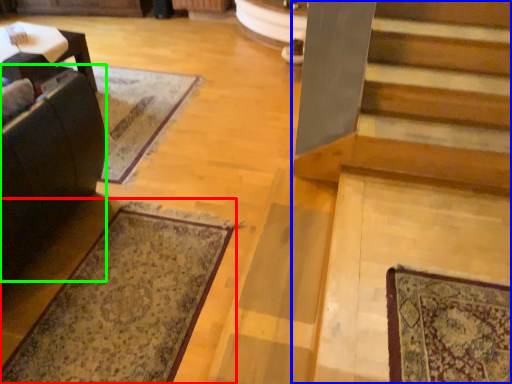
Question: Considering the real-world distances, which object is closest to mat (highlighted by a red box)? stairs (highlighted by a blue box) or rocking chair (highlighted by a green box).

Choices:
 (A) stairs
 (B) rocking chair

Answer: (B)